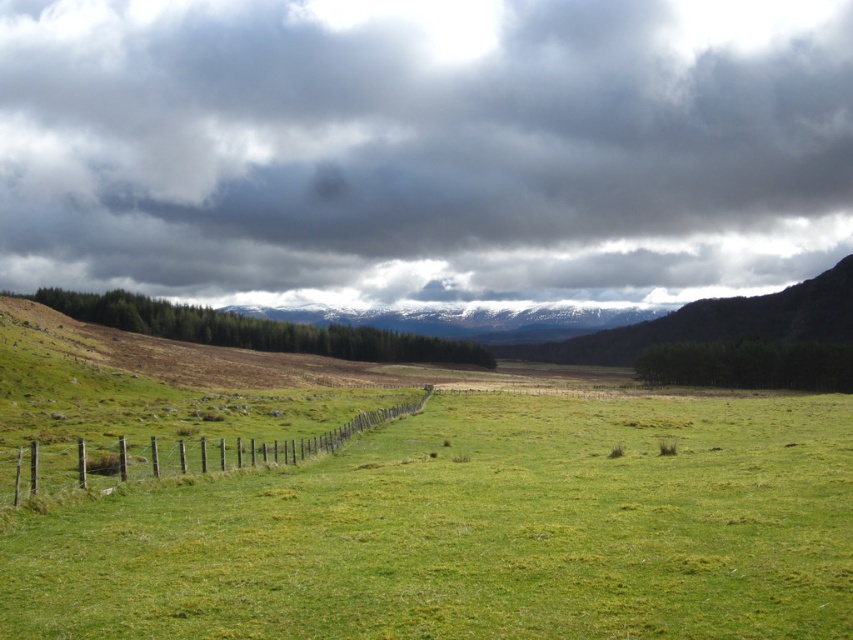
Question: Can you confirm if dark gray cloud at upper center is bigger than brown wooden fence at lower left?

Choices:
 (A) no
 (B) yes

Answer: (B)

Question: Which of the following is the farthest from the observer?

Choices:
 (A) (550, 547)
 (B) (9, 497)
 (C) (705, 280)

Answer: (C)

Question: Does green grass pasture at center have a greater width compared to brown wooden fence at lower left?

Choices:
 (A) no
 (B) yes

Answer: (B)

Question: Which point is closer to the camera taking this photo?

Choices:
 (A) (154, 448)
 (B) (386, 180)
 (C) (277, 520)

Answer: (C)

Question: Does dark gray cloud at upper center appear on the left side of green grass pasture at center?

Choices:
 (A) yes
 (B) no

Answer: (A)

Question: Which object is positioned farthest from the green grass pasture at center?

Choices:
 (A) dark gray cloud at upper center
 (B) brown wooden fence at lower left

Answer: (A)